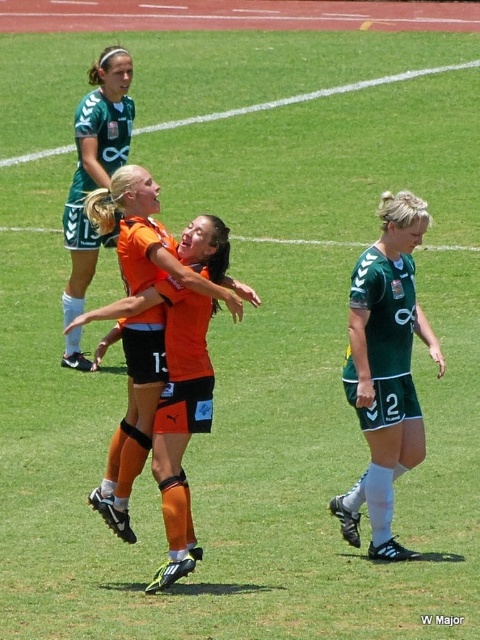
Question: Which point is closer to the camera?

Choices:
 (A) (88, 180)
 (B) (356, 525)

Answer: (B)

Question: Can you confirm if green matte jersey at center is smaller than green jersey at upper left?

Choices:
 (A) no
 (B) yes

Answer: (B)

Question: Which of the following is the farthest from the observer?

Choices:
 (A) (158, 372)
 (B) (111, 102)
 (C) (395, 193)

Answer: (C)

Question: Is orange matte jersey at center below green jersey at upper left?

Choices:
 (A) no
 (B) yes

Answer: (B)

Question: Which of these objects is positioned farthest from the green jersey at upper left?

Choices:
 (A) orange matte jersey at center
 (B) green matte jersey at center

Answer: (B)

Question: Is green matte jersey at center thinner than green jersey at upper left?

Choices:
 (A) no
 (B) yes

Answer: (A)